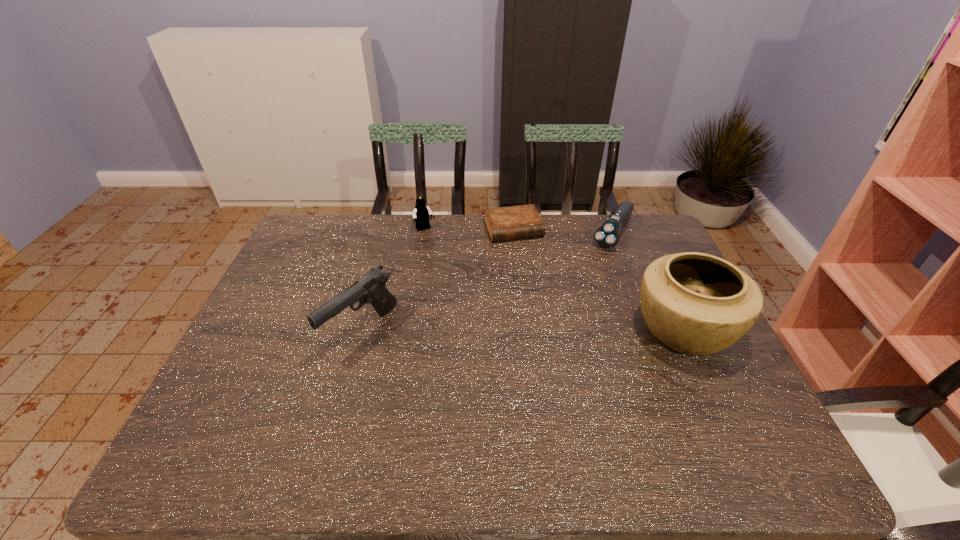
Find the location of a particular element. Image resolution: width=960 pixels, height=540 pixels. the second tallest object is located at coordinates (370, 288).

The width and height of the screenshot is (960, 540). I want to click on gun, so click(370, 288).

Find the location of `the tallest object`. the tallest object is located at coordinates (698, 304).

Image resolution: width=960 pixels, height=540 pixels. I want to click on the fourth tallest object, so click(x=607, y=235).

This screenshot has height=540, width=960. In order to click on the third object from right to left in this screenshot , I will do `click(524, 221)`.

Find the location of a particular element. the shortest object is located at coordinates (524, 221).

This screenshot has height=540, width=960. I want to click on the second object from left to right, so click(421, 213).

Where is `Lego`? The height and width of the screenshot is (540, 960). Lego is located at coordinates (421, 213).

At what (x,y) coordinates should I click in order to perform the action: click on free spot located at the muzzle of the fourth shortest object. Please return your answer as a coordinate pair (x, y). The image size is (960, 540). Looking at the image, I should click on (344, 397).

Find the location of a particular element. The image size is (960, 540). vacant space situated 0.270m on the back of the pottery is located at coordinates (641, 239).